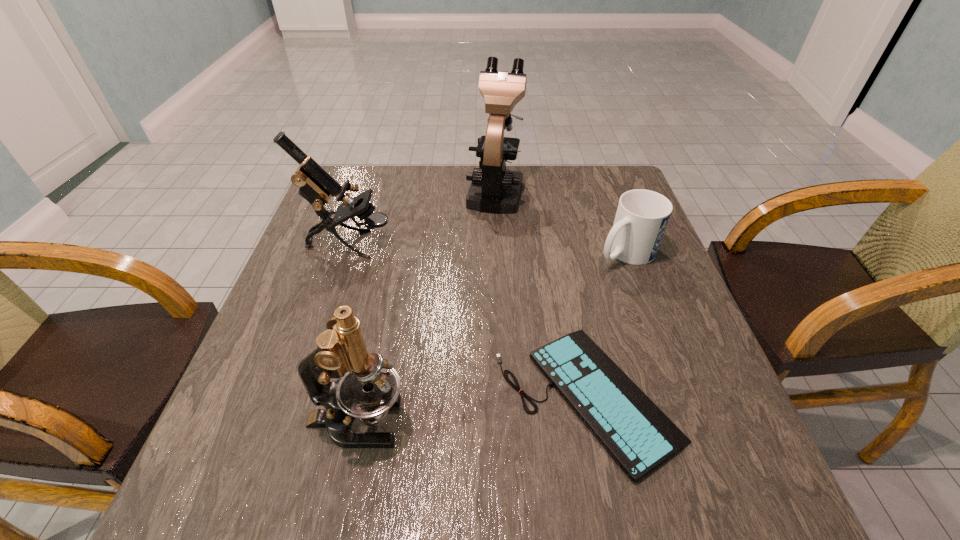
Locate an element on the screen. the rightmost microscope is located at coordinates (494, 189).

I want to click on the farthest object, so click(x=494, y=189).

The image size is (960, 540). I want to click on the second farthest microscope, so click(316, 186).

You are a GUI agent. You are given a task and a screenshot of the screen. Output one action in this format:
    pyautogui.click(x=<x>, y=<y>)
    Task: Click on the nearest microscope
    The image size is (960, 540).
    Given the screenshot: What is the action you would take?
    pyautogui.click(x=371, y=386)

At what (x,y) coordinates should I click in order to perform the action: click on the fourth tallest object. Please return your answer as a coordinate pair (x, y). This screenshot has height=540, width=960. Looking at the image, I should click on (642, 216).

Identify the location of computer keyboard. The width and height of the screenshot is (960, 540). (636, 433).

This screenshot has width=960, height=540. Find the location of `vacant space positioned on the front of the farthest object`. vacant space positioned on the front of the farthest object is located at coordinates (496, 230).

Locate an element on the screen. The width and height of the screenshot is (960, 540). free region located through the eyepiece of the second nearest microscope is located at coordinates (454, 244).

Find the location of a particular element. This screenshot has width=960, height=540. free spot located at the eyepiece of the nearest microscope is located at coordinates (x=448, y=422).

The image size is (960, 540). I want to click on vacant space located on the left of the mug, so click(x=495, y=252).